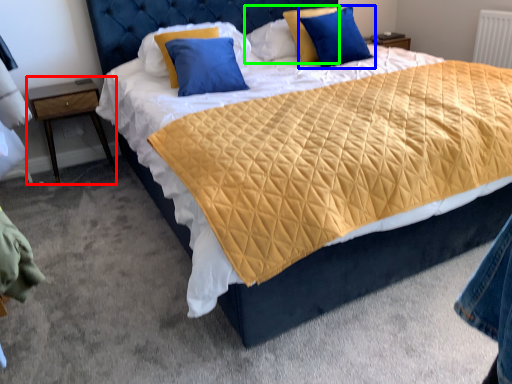
Question: Which is nearer to the nightstand (highlighted by a red box)? pillow (highlighted by a blue box) or pillow (highlighted by a green box).

Choices:
 (A) pillow
 (B) pillow

Answer: (B)